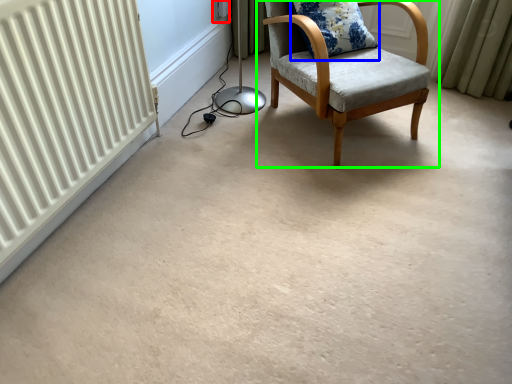
Question: Estimate the real-world distances between objects in this image. Which object is farther from electric outlet (highlighted by a red box), pillow (highlighted by a blue box) or chair (highlighted by a green box)?

Choices:
 (A) pillow
 (B) chair

Answer: (B)